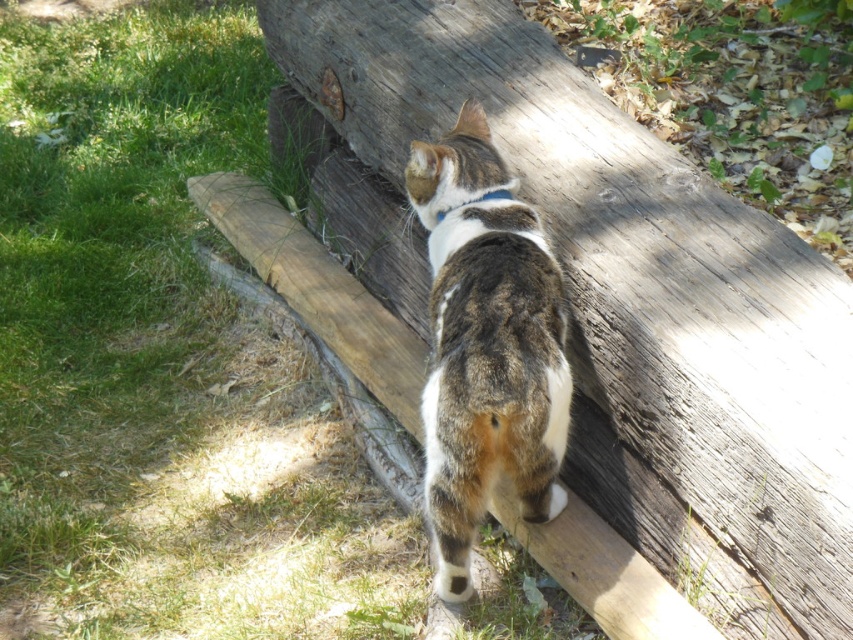
Does weathered wood at center appear on the right side of tabby fur cat at center?

Incorrect, weathered wood at center is not on the right side of tabby fur cat at center.

Is point (767, 240) more distant than point (489, 260)?

Yes, it is.

I want to click on weathered wood at center, so click(x=633, y=300).